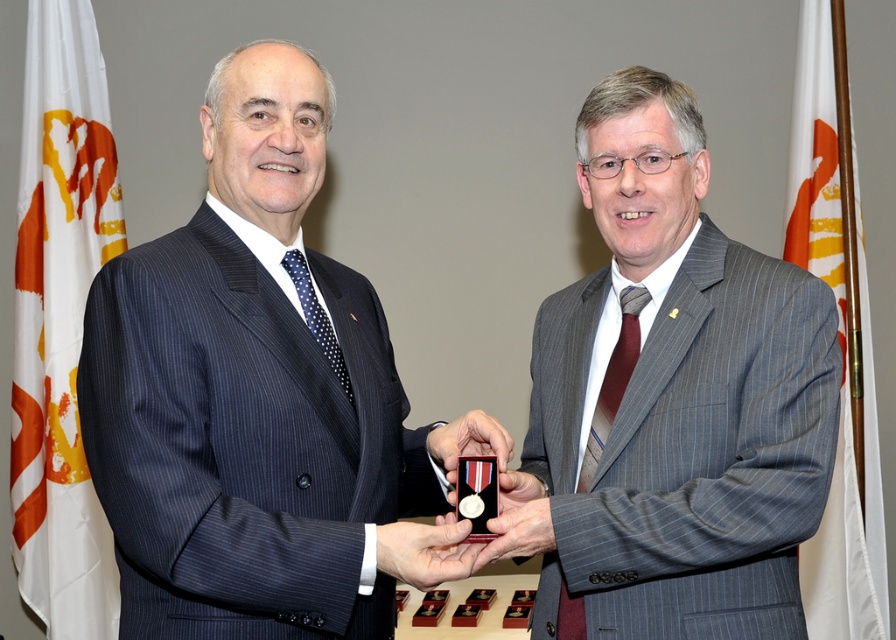
Question: Observing the image, what is the correct spatial positioning of dark blue pinstripe suit at center in reference to metallic/polished medal at center?

Choices:
 (A) above
 (B) below

Answer: (A)

Question: Does gray pinstripe suit at center lie in front of metallic red box at center?

Choices:
 (A) no
 (B) yes

Answer: (A)

Question: Which of the following is the farthest from the observer?

Choices:
 (A) (161, 576)
 (B) (810, 568)
 (C) (622, 216)
 (D) (464, 452)

Answer: (B)

Question: Which of these objects is positioned closest to the gray pinstripe suit at center?

Choices:
 (A) white fabric flag at left
 (B) metallic/polished medal at center
 (C) metallic medal at center
 (D) dark blue pinstripe suit at center

Answer: (B)

Question: Can you confirm if white fabric flag at left is positioned to the left of metallic red box at center?

Choices:
 (A) no
 (B) yes

Answer: (B)

Question: Which point is farther from the camera taking this photo?

Choices:
 (A) (483, 563)
 (B) (487, 433)
 (C) (308, 100)
 (D) (67, 17)

Answer: (D)